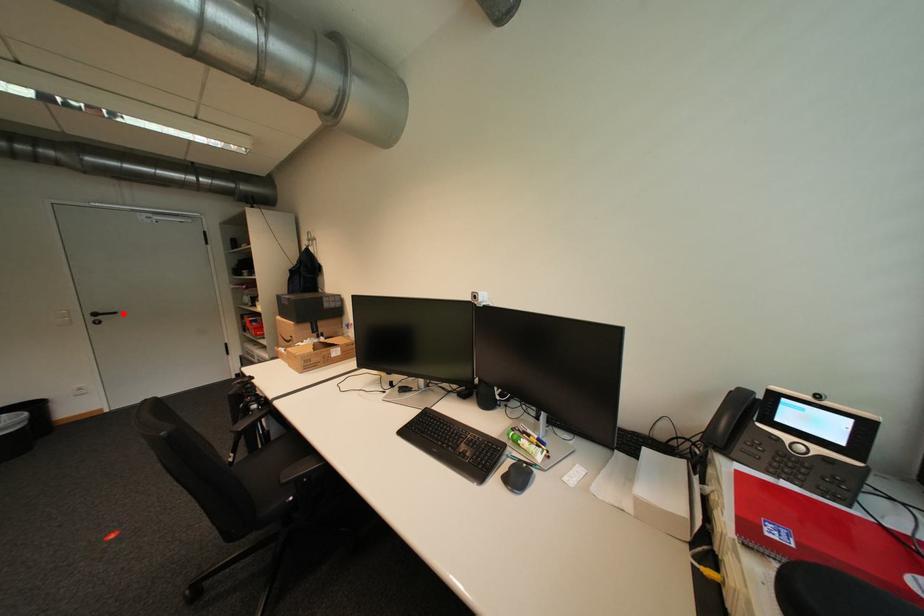
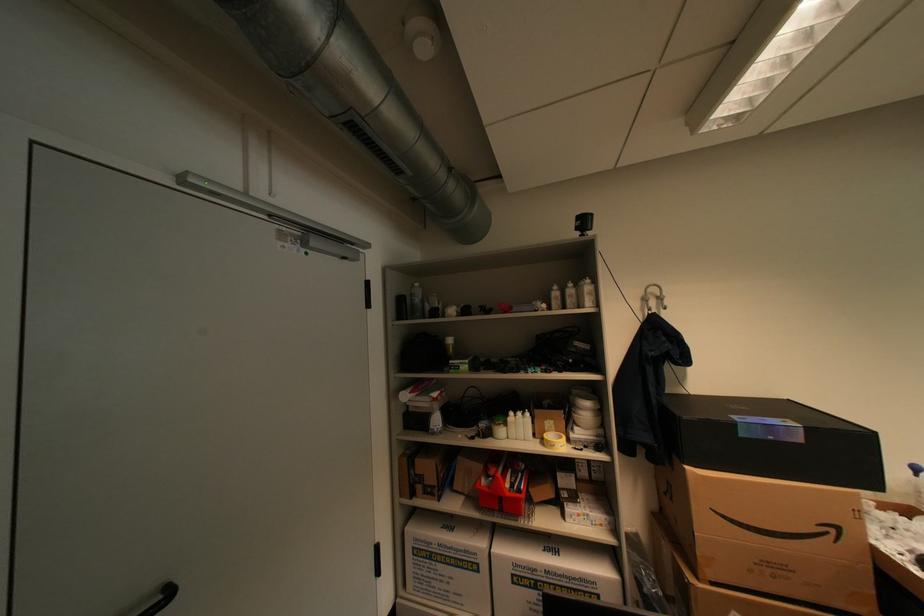
Locate, in the second image, the point that corresponds to the highlighted location in the first image.

(176, 594)